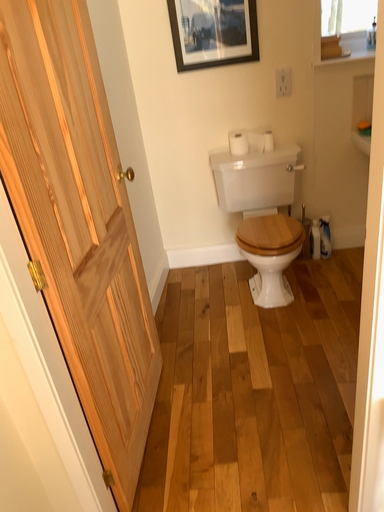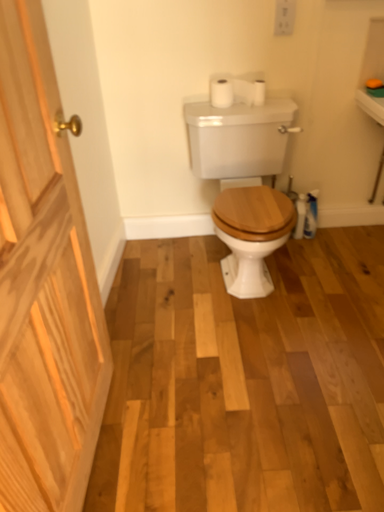
Question: Which way did the camera rotate in the video?

Choices:
 (A) rotated upward
 (B) rotated downward

Answer: (B)